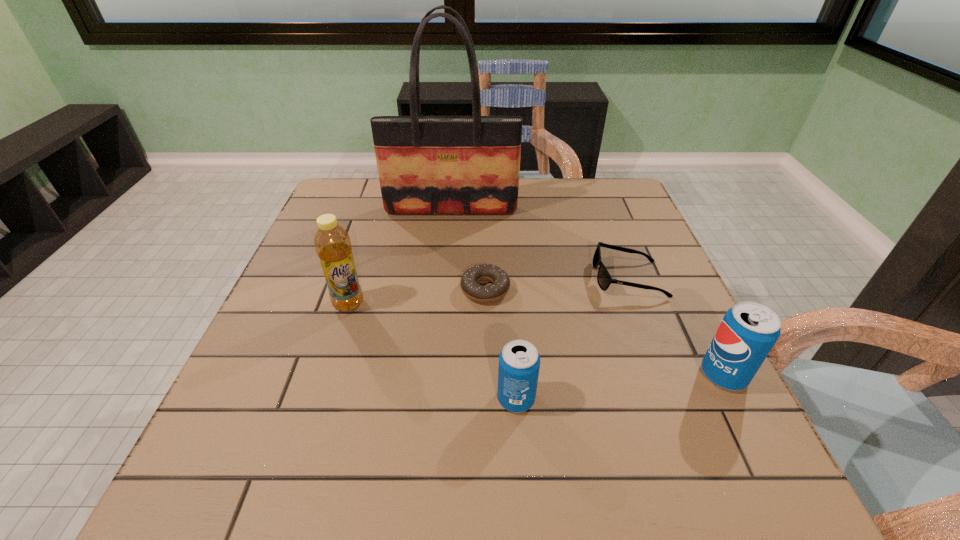
Find the location of a particular element. Image resolution: width=960 pixels, height=540 pixels. the left soda can is located at coordinates (519, 361).

Identify the location of the shorter soda can. This screenshot has height=540, width=960. (519, 361).

Identify the location of the right soda can. This screenshot has width=960, height=540. (748, 331).

In order to click on the fourth shortest object in this screenshot , I will do `click(748, 331)`.

Identify the location of shopping bag. (426, 164).

The width and height of the screenshot is (960, 540). Identify the location of the farthest object. (426, 164).

Locate an element on the screen. The height and width of the screenshot is (540, 960). the shortest object is located at coordinates (469, 281).

Locate an element on the screen. Image resolution: width=960 pixels, height=540 pixels. bottle is located at coordinates (332, 243).

What are the coordinates of `the fifth tallest object` in the screenshot? It's located at (604, 279).

Locate an element on the screen. Image resolution: width=960 pixels, height=540 pixels. vacant space located 0.140m on the back of the shorter soda can is located at coordinates tap(511, 327).